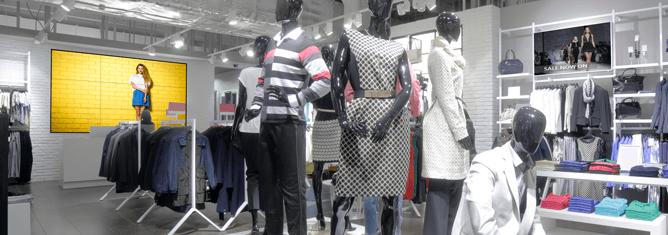
Find the location of a particular element. This screenshot has width=668, height=235. clothes rack is located at coordinates (194, 135), (120, 137).